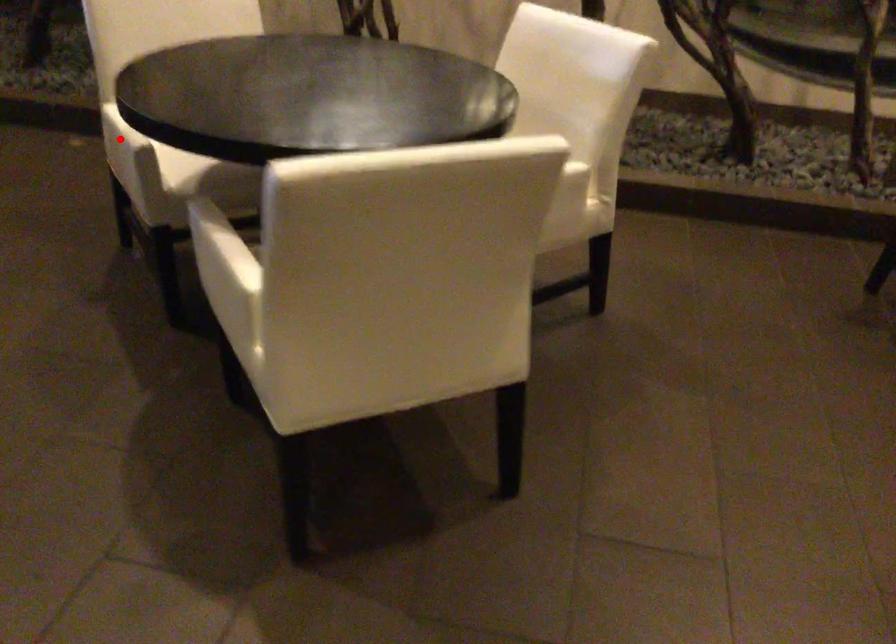
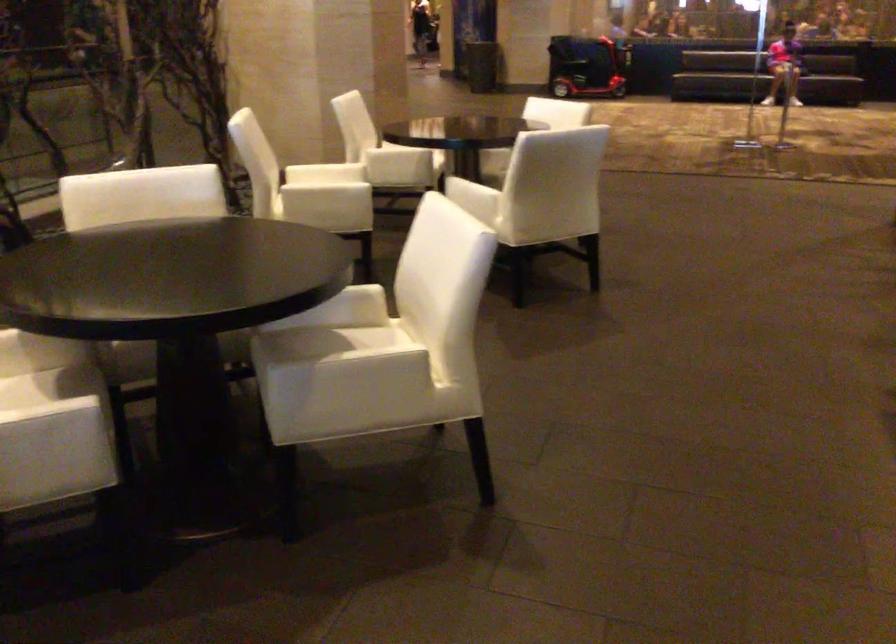
Where in the second image is the point corresponding to the highlighted location from the first image?

(56, 422)